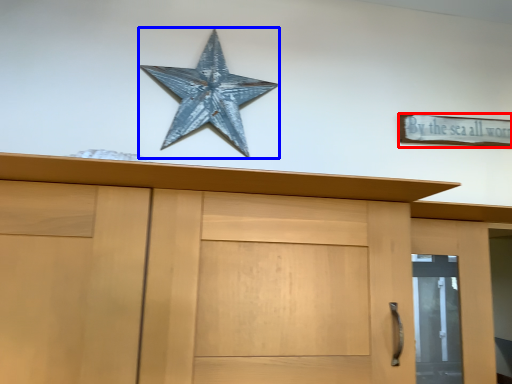
Question: Which object appears farthest to the camera in this image, magnet (highlighted by a red box) or starfish (highlighted by a blue box)?

Choices:
 (A) magnet
 (B) starfish

Answer: (A)